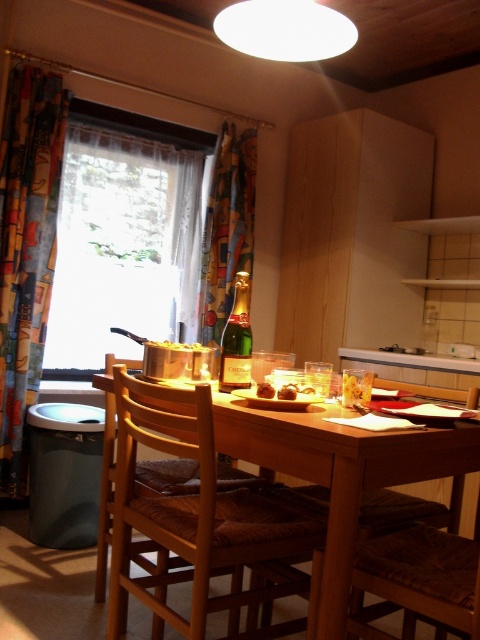
Looking at this image, you are sitting at the dining table in the cozy dining area and want to reach both the point at coordinates point (441,573) and point (218,243). Which point should you move towards first to reach the one closer to you?

You should move towards point (441,573) first because it is in front of point (218,243), making it closer to your current position at the dining table.

In the scene shown: You are planning to rearrange the dining area and want to place a new decorative item between the brown woven chair at lower right and the multicolored fabric curtain at center. Considering their sizes, which object should you place the item closer to?

A: Since the brown woven chair at lower right is larger than the multicolored fabric curtain at center, you should place the decorative item closer to the multicolored fabric curtain at center to ensure enough space around the larger chair.

You are standing in the dining area and want to reach the point marked as point [238,371]. If your reach is 1.8 meters, can you comfortably touch it without moving your feet?

The point [238,371] is 1.93 meters from the camera, so it is slightly out of your reach since your maximum reach is 1.8 meters. You would need to take a step forward to touch it.